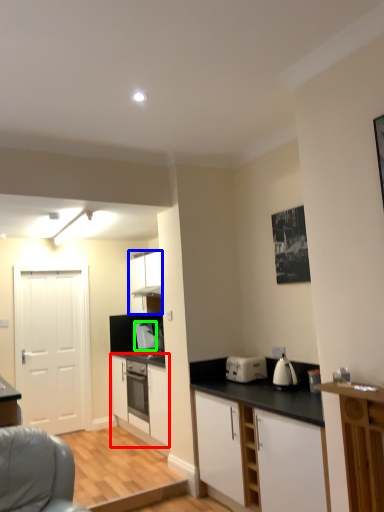
Question: Estimate the real-world distances between objects in this image. Which object is closer to cabinetry (highlighted by a red box), cabinetry (highlighted by a blue box) or kitchen appliance (highlighted by a green box)?

Choices:
 (A) cabinetry
 (B) kitchen appliance

Answer: (B)